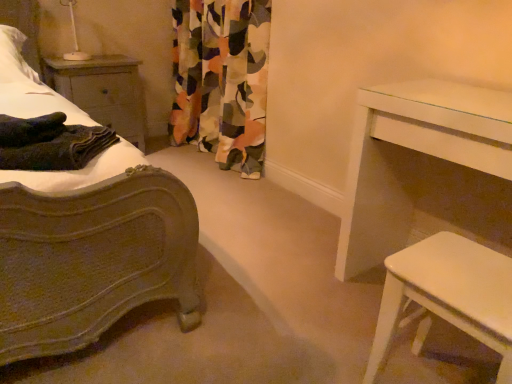
Question: From a real-world perspective, is white glossy stool at lower right, the 2th table viewed from the back, beneath white glossy table at right, which is the first table from back to front?

Choices:
 (A) no
 (B) yes

Answer: (B)

Question: Could you tell me if white glossy stool at lower right, the 2th table viewed from the back, is turned towards white glossy table at right, the 2th table positioned from the front?

Choices:
 (A) no
 (B) yes

Answer: (A)

Question: Is white glossy stool at lower right, which appears as the 1th table when viewed from the front, to the right of white glossy table at right, the 2th table positioned from the front, from the viewer's perspective?

Choices:
 (A) no
 (B) yes

Answer: (A)

Question: Is white glossy stool at lower right, which appears as the 1th table when viewed from the front, not close to white glossy table at right, the 2th table positioned from the front?

Choices:
 (A) no
 (B) yes

Answer: (A)

Question: Is white glossy stool at lower right, the 2th table viewed from the back, outside of white glossy table at right, the 2th table positioned from the front?

Choices:
 (A) no
 (B) yes

Answer: (B)

Question: From their relative heights in the image, would you say white glossy stool at lower right, which appears as the 1th table when viewed from the front, is taller or shorter than white soft pillow at upper left?

Choices:
 (A) tall
 (B) short

Answer: (A)

Question: From the image's perspective, is white glossy stool at lower right, the 2th table viewed from the back, located above or below white soft pillow at upper left?

Choices:
 (A) below
 (B) above

Answer: (A)

Question: Which is correct: white glossy stool at lower right, which appears as the 1th table when viewed from the front, is inside white soft pillow at upper left, or outside of it?

Choices:
 (A) inside
 (B) outside

Answer: (B)

Question: Is point (395, 278) closer or farther from the camera than point (35, 74)?

Choices:
 (A) closer
 (B) farther

Answer: (A)

Question: From the image's perspective, is dark green textured blanket at left located above or below white glossy stool at lower right, which appears as the 1th table when viewed from the front?

Choices:
 (A) above
 (B) below

Answer: (A)

Question: From a real-world perspective, is dark green textured blanket at left physically located above or below white glossy stool at lower right, the 2th table viewed from the back?

Choices:
 (A) below
 (B) above

Answer: (B)

Question: In terms of size, does dark green textured blanket at left appear bigger or smaller than white glossy stool at lower right, the 2th table viewed from the back?

Choices:
 (A) small
 (B) big

Answer: (A)

Question: Considering the positions of point (88, 132) and point (445, 317), is point (88, 132) closer or farther from the camera than point (445, 317)?

Choices:
 (A) closer
 (B) farther

Answer: (B)

Question: Based on their sizes in the image, would you say wooden nightstand at left is bigger or smaller than dark green textured blanket at left?

Choices:
 (A) small
 (B) big

Answer: (B)

Question: Considering the positions of wooden nightstand at left and dark green textured blanket at left in the image, is wooden nightstand at left wider or thinner than dark green textured blanket at left?

Choices:
 (A) wide
 (B) thin

Answer: (A)